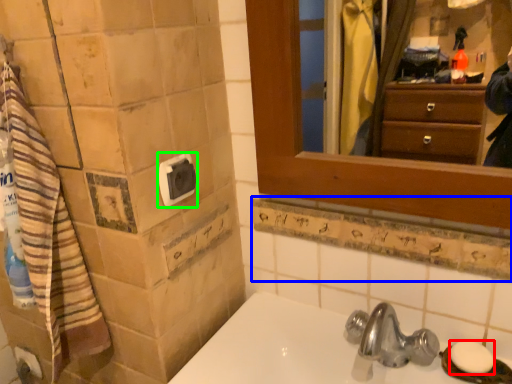
Question: Based on their relative distances, which object is farther from soap (highlighted by a red box)? Choose from ledge (highlighted by a blue box) and towel bar (highlighted by a green box).

Choices:
 (A) ledge
 (B) towel bar

Answer: (B)